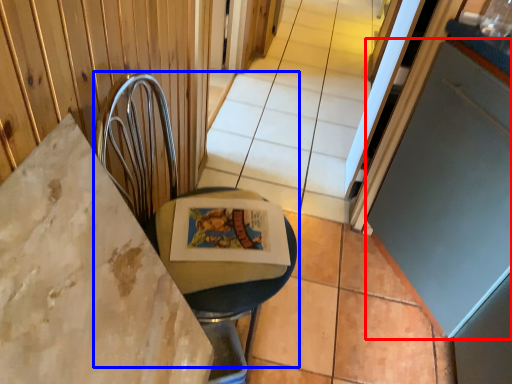
Question: Which point is further to the camera, screen door (highlighted by a red box) or swivel chair (highlighted by a blue box)?

Choices:
 (A) screen door
 (B) swivel chair

Answer: (A)